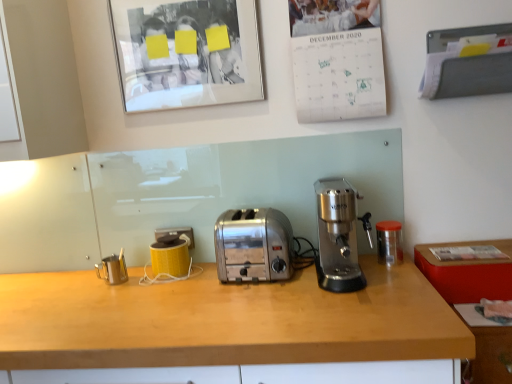
Identify the location of vacant area to the left of satin silver coffee maker at center. The image size is (512, 384). (291, 278).